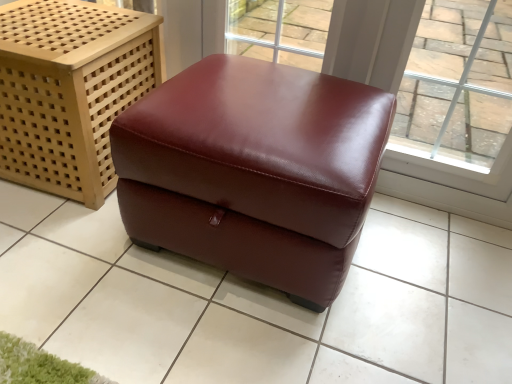
You are a GUI agent. You are given a task and a screenshot of the screen. Output one action in this format:
    pyautogui.click(x=<x>, y=<y>)
    Task: Click on the free spot in front of burgundy leather ottoman at center, the 2th furniture from the left
    The width and height of the screenshot is (512, 384).
    Given the screenshot: What is the action you would take?
    pyautogui.click(x=208, y=332)